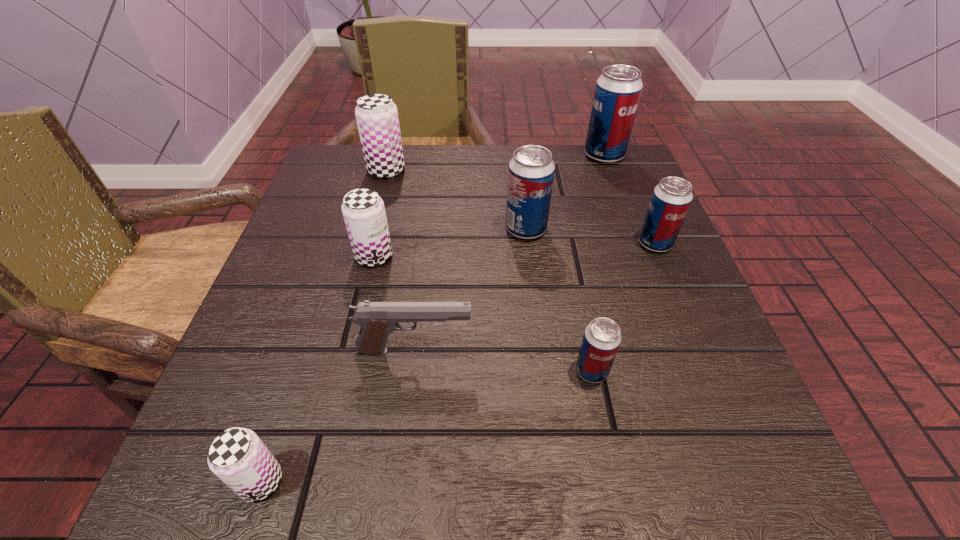
I want to click on the second closest object to the third biggest red beer can, so click(618, 90).

Select which object appears as the closest to the second nearest beer can. Please provide its 2D coordinates. Your answer should be formatted as a tuple, i.e. [(x, y)], where the tuple contains the x and y coordinates of a point satisfying the conditions above.

[(377, 320)]

Point out which beer can is positioned as the third nearest to the second smallest purple beer can. Please provide its 2D coordinates. Your answer should be formatted as a tuple, i.e. [(x, y)], where the tuple contains the x and y coordinates of a point satisfying the conditions above.

[(237, 456)]

Select which beer can is the closest to the biggest purple beer can. Please provide its 2D coordinates. Your answer should be formatted as a tuple, i.e. [(x, y)], where the tuple contains the x and y coordinates of a point satisfying the conditions above.

[(363, 210)]

Find the location of a particular element. The image size is (960, 540). red beer can identified as the closest to the tallest beer can is located at coordinates (531, 171).

Locate an element on the screen. The image size is (960, 540). red beer can that is the nearest to the second smallest purple beer can is located at coordinates (531, 171).

Identify which purple beer can is located as the second nearest to the nearest beer can. Please provide its 2D coordinates. Your answer should be formatted as a tuple, i.e. [(x, y)], where the tuple contains the x and y coordinates of a point satisfying the conditions above.

[(376, 114)]

The image size is (960, 540). Identify the location of purple beer can that is the second nearest to the seventh farthest object. (237, 456).